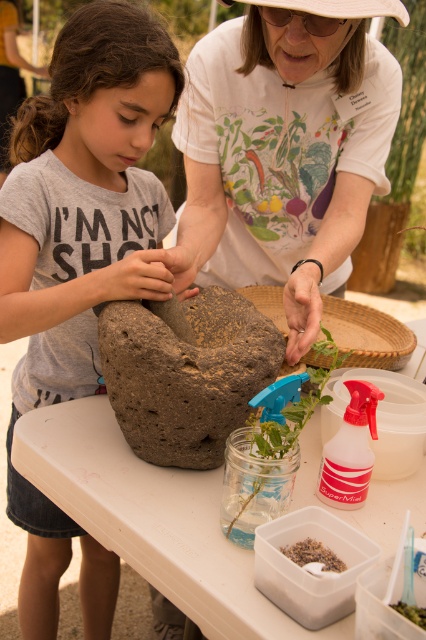
Question: Which of the following is the closest to the observer?

Choices:
 (A) white plastic table at center
 (B) translucent glass jar at center

Answer: (A)

Question: Does white cotton shirt at upper center have a greater width compared to brown rough stone at center?

Choices:
 (A) yes
 (B) no

Answer: (A)

Question: From the image, what is the correct spatial relationship of brown matte rock at center in relation to brown rough stone at center?

Choices:
 (A) left
 (B) right

Answer: (A)

Question: Which object appears farthest from the camera in this image?

Choices:
 (A) translucent glass jar at center
 (B) white plastic table at center
 (C) brown rough stone at center

Answer: (C)

Question: Can you confirm if brown rough stone at center is positioned to the left of translucent glass jar at center?

Choices:
 (A) no
 (B) yes

Answer: (B)

Question: Estimate the real-world distances between objects in this image. Which object is farther from the brown rough stone at center?

Choices:
 (A) white plastic table at center
 (B) white cotton shirt at upper center
 (C) translucent glass jar at center

Answer: (B)